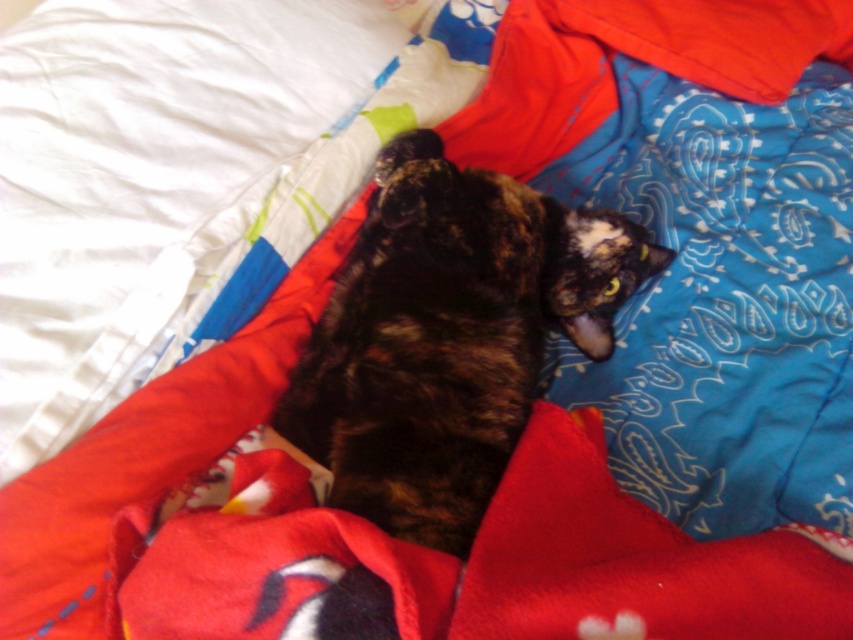
Is point (42, 218) positioned in front of point (502, 339)?

No, it is behind (502, 339).

Which of these two, white soft pillow at upper left or shiny tortoiseshell cat at center, stands taller?

Standing taller between the two is white soft pillow at upper left.

Where is `white soft pillow at upper left`? white soft pillow at upper left is located at coordinates (148, 177).